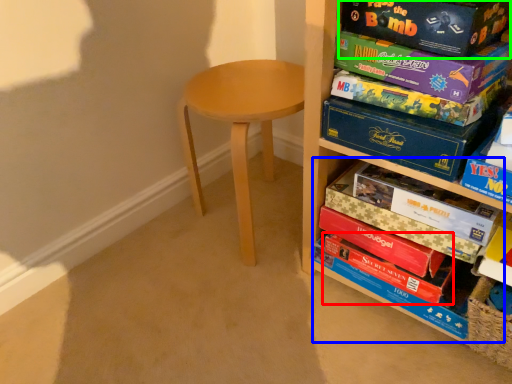
Question: Which object is positioned farthest from paperback book (highlighted by a red box)? Select from book (highlighted by a blue box) and paperback book (highlighted by a green box).

Choices:
 (A) book
 (B) paperback book

Answer: (B)